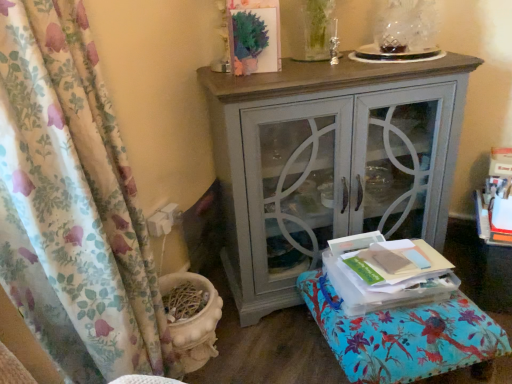
The image size is (512, 384). What do you see at coordinates (72, 204) in the screenshot? I see `floral fabric curtain at left` at bounding box center [72, 204].

Image resolution: width=512 pixels, height=384 pixels. What are the coordinates of `floral fabric ottoman at lower right` in the screenshot? It's located at (403, 336).

Find the location of a particular element. Image resolution: width=512 pixels, height=384 pixels. furniture that appears below the floral fabric curtain at left (from the image's perspective) is located at coordinates (403, 336).

Considering the relative positions of floral fabric ottoman at lower right and floral fabric curtain at left in the image provided, is floral fabric ottoman at lower right to the left or to the right of floral fabric curtain at left?

Based on their positions, floral fabric ottoman at lower right is located to the right of floral fabric curtain at left.

Would you say floral fabric ottoman at lower right is inside or outside floral fabric curtain at left?

The correct answer is: outside.

Is floral fabric ottoman at lower right in contact with floral fabric curtain at left?

No, floral fabric ottoman at lower right is not making contact with floral fabric curtain at left.

From a real-world perspective, between matte gray cabinet at center and floral fabric curtain at left, who is vertically higher?

From a 3D spatial view, floral fabric curtain at left is above.

Is matte gray cabinet at center touching floral fabric curtain at left?

No, matte gray cabinet at center is not making contact with floral fabric curtain at left.

Is matte gray cabinet at center oriented away from floral fabric curtain at left?

matte gray cabinet at center does not have its back to floral fabric curtain at left.

Based on their positions, is matte gray cabinet at center located to the left or right of floral fabric ottoman at lower right?

matte gray cabinet at center is to the left of floral fabric ottoman at lower right.

From the image's perspective, which one is positioned higher, matte gray cabinet at center or floral fabric ottoman at lower right?

matte gray cabinet at center.

From a real-world perspective, is matte gray cabinet at center physically above floral fabric ottoman at lower right?

Yes, from a real-world perspective, matte gray cabinet at center is above floral fabric ottoman at lower right.

From a real-world perspective, between floral fabric curtain at left and matte gray cabinet at center, who is vertically higher?

In real-world perspective, floral fabric curtain at left is above.

Does point (3, 163) come closer to viewer compared to point (239, 261)?

Yes, it is.

Is floral fabric curtain at left turned away from matte gray cabinet at center?

floral fabric curtain at left does not have its back to matte gray cabinet at center.

From the image's perspective, which one is positioned higher, floral fabric curtain at left or matte gray cabinet at center?

matte gray cabinet at center, from the image's perspective.

From the image's perspective, is floral fabric curtain at left under floral fabric ottoman at lower right?

No.

Which of these two, floral fabric curtain at left or floral fabric ottoman at lower right, is smaller?

floral fabric ottoman at lower right is smaller.

Based on the photo, is floral fabric curtain at left aimed at floral fabric ottoman at lower right?

No, floral fabric curtain at left is not facing towards floral fabric ottoman at lower right.

Is matte gray cabinet at center at the back of floral fabric ottoman at lower right?

Yes, floral fabric ottoman at lower right is facing away from matte gray cabinet at center.

Does point (385, 355) come closer to viewer compared to point (331, 121)?

Yes, point (385, 355) is in front of point (331, 121).

Is floral fabric ottoman at lower right to the left of matte gray cabinet at center from the viewer's perspective?

Incorrect, floral fabric ottoman at lower right is not on the left side of matte gray cabinet at center.

From a real-world perspective, between floral fabric ottoman at lower right and matte gray cabinet at center, who is vertically lower?

In real-world perspective, floral fabric ottoman at lower right is lower.

This screenshot has height=384, width=512. I want to click on curtain in front of the floral fabric ottoman at lower right, so click(72, 204).

Identify the location of nightstand above the floral fabric curtain at left (from the image's perspective). coord(329,163).

From the image, which object appears to be nearer to floral fabric ottoman at lower right, floral fabric curtain at left or matte gray cabinet at center?

The object closer to floral fabric ottoman at lower right is matte gray cabinet at center.

Looking at the image, which one is located closer to floral fabric curtain at left, floral fabric ottoman at lower right or matte gray cabinet at center?

matte gray cabinet at center lies closer to floral fabric curtain at left than the other object.

Estimate the real-world distances between objects in this image. Which object is further from floral fabric curtain at left, matte gray cabinet at center or floral fabric ottoman at lower right?

floral fabric ottoman at lower right is positioned further to the anchor floral fabric curtain at left.

Looking at the image, which one is located further to matte gray cabinet at center, floral fabric ottoman at lower right or floral fabric curtain at left?

The object further to matte gray cabinet at center is floral fabric curtain at left.

Based on their spatial positions, is floral fabric curtain at left or floral fabric ottoman at lower right further from matte gray cabinet at center?

floral fabric curtain at left lies further to matte gray cabinet at center than the other object.

When comparing their distances from floral fabric ottoman at lower right, does matte gray cabinet at center or floral fabric curtain at left seem further?

floral fabric curtain at left.

This screenshot has width=512, height=384. In order to click on nightstand located between floral fabric curtain at left and floral fabric ottoman at lower right in the left-right direction in this screenshot , I will do `click(329, 163)`.